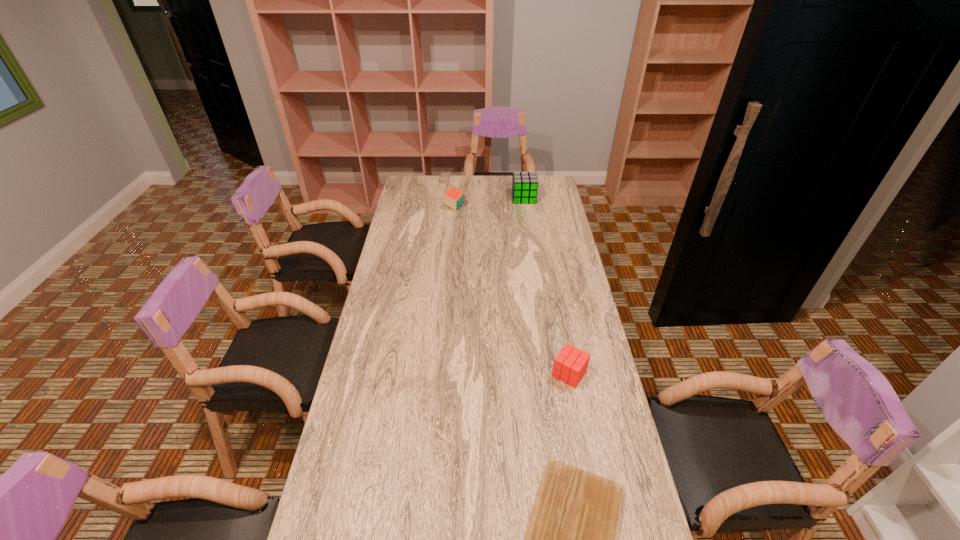
The height and width of the screenshot is (540, 960). I want to click on vacant space at the right edge, so click(x=563, y=226).

The width and height of the screenshot is (960, 540). In the image, there is a desktop. Find the location of `vacant space at the far left corner`. vacant space at the far left corner is located at coordinates (434, 181).

I want to click on vacant space at the far right corner, so click(540, 190).

I want to click on free point between the shortest cube and the tallest cube, so click(x=546, y=286).

This screenshot has width=960, height=540. In order to click on unoccupied area between the third farthest object and the tallest cube in this screenshot , I will do `click(546, 286)`.

I want to click on unoccupied position between the second shortest object and the leftmost object, so click(512, 291).

This screenshot has height=540, width=960. I want to click on free space between the leftmost cube and the tallest object, so click(490, 202).

Where is `object that is the second nearest to the third tallest object`? The image size is (960, 540). object that is the second nearest to the third tallest object is located at coordinates (454, 198).

Identify which object is the third closest to the tallest cube. Please provide its 2D coordinates. Your answer should be formatted as a tuple, i.e. [(x, y)], where the tuple contains the x and y coordinates of a point satisfying the conditions above.

[(571, 539)]

Find the location of a particular element. Image resolution: width=960 pixels, height=540 pixels. cube object that ranks as the third closest to the shortest object is located at coordinates pos(524,184).